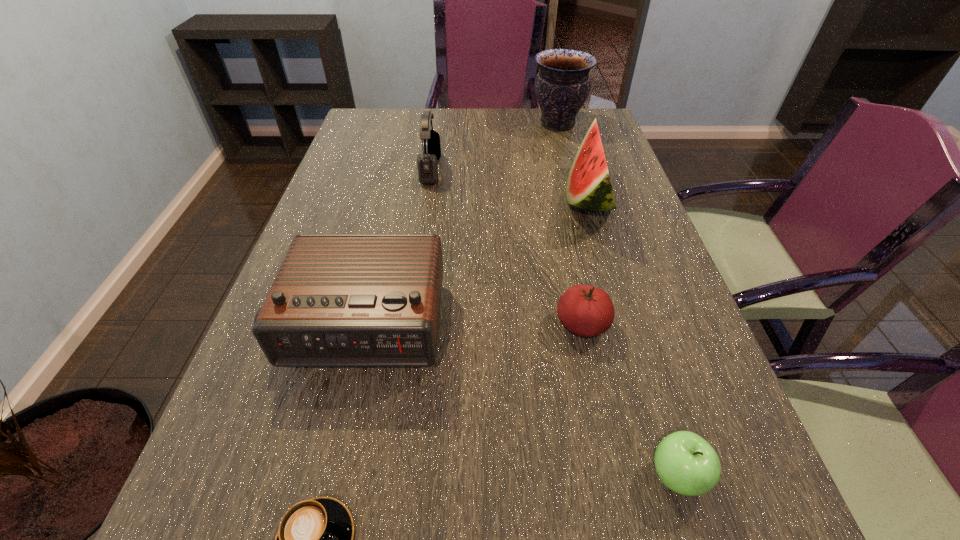
This screenshot has height=540, width=960. What are the coordinates of `pottery` in the screenshot? It's located at (562, 85).

You are a GUI agent. You are given a task and a screenshot of the screen. Output one action in this format:
    pyautogui.click(x=<x>, y=<y>)
    Task: Click on the watermelon
    Image resolution: width=960 pixels, height=540 pixels.
    Given the screenshot: What is the action you would take?
    pyautogui.click(x=588, y=186)

Find the location of a particular element. This screenshot has width=960, height=540. headset is located at coordinates (427, 162).

The width and height of the screenshot is (960, 540). I want to click on radio receiver, so click(x=339, y=300).

The width and height of the screenshot is (960, 540). In order to click on tomato in this screenshot , I will do `click(586, 311)`.

This screenshot has width=960, height=540. I want to click on apple, so click(687, 464).

The width and height of the screenshot is (960, 540). What are the coordinates of `vacant space situated 0.320m on the front handle of the pottery` in the screenshot? It's located at (438, 124).

What are the coordinates of `blank space located 0.050m on the front handle of the pottery` in the screenshot? It's located at (516, 124).

The height and width of the screenshot is (540, 960). I want to click on vacant area situated on the front handle of the pottery, so click(467, 124).

You are a GUI agent. You are given a task and a screenshot of the screen. Output one action in this format:
    pyautogui.click(x=<x>, y=<y>)
    Task: Click on the free space located 0.230m on the outer rind of the watermelon
    The width and height of the screenshot is (960, 540).
    Given the screenshot: What is the action you would take?
    pyautogui.click(x=480, y=199)